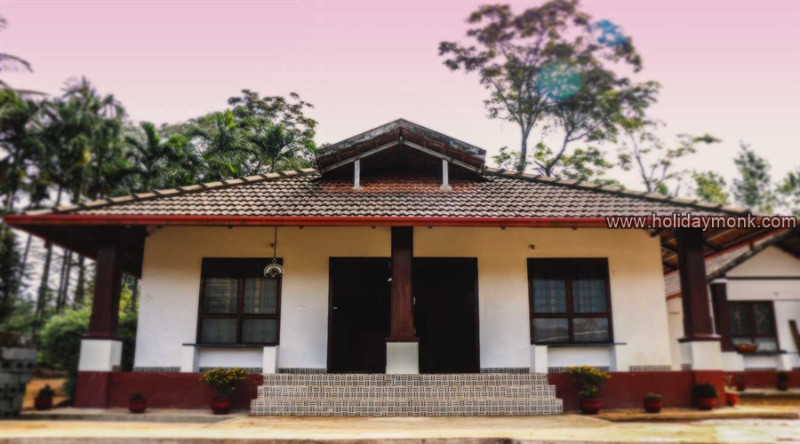
What are the coordinates of `pots` in the screenshot? It's located at (585, 408), (221, 403), (652, 405), (701, 406), (136, 409), (42, 405).